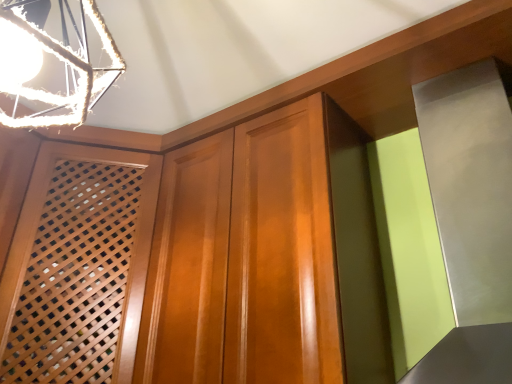
Question: Is metallic rope at upper left outside wooden lattice screen at left?

Choices:
 (A) no
 (B) yes

Answer: (B)

Question: Can you confirm if metallic rope at upper left is shorter than wooden lattice screen at left?

Choices:
 (A) yes
 (B) no

Answer: (A)

Question: From the image's perspective, does metallic rope at upper left appear lower than wooden lattice screen at left?

Choices:
 (A) no
 (B) yes

Answer: (A)

Question: Can you confirm if metallic rope at upper left is smaller than wooden lattice screen at left?

Choices:
 (A) yes
 (B) no

Answer: (A)

Question: Considering the relative sizes of metallic rope at upper left and wooden lattice screen at left in the image provided, is metallic rope at upper left taller than wooden lattice screen at left?

Choices:
 (A) yes
 (B) no

Answer: (B)

Question: From the image's perspective, does metallic rope at upper left appear higher than wooden lattice screen at left?

Choices:
 (A) yes
 (B) no

Answer: (A)

Question: From the image's perspective, is wooden lattice screen at left beneath metallic rope at upper left?

Choices:
 (A) yes
 (B) no

Answer: (A)

Question: Is wooden lattice screen at left wider than metallic rope at upper left?

Choices:
 (A) yes
 (B) no

Answer: (A)

Question: Is the position of wooden lattice screen at left more distant than that of metallic rope at upper left?

Choices:
 (A) yes
 (B) no

Answer: (A)

Question: From a real-world perspective, is wooden lattice screen at left below metallic rope at upper left?

Choices:
 (A) no
 (B) yes

Answer: (B)

Question: Is wooden lattice screen at left directly adjacent to metallic rope at upper left?

Choices:
 (A) yes
 (B) no

Answer: (B)

Question: Is wooden lattice screen at left taller than metallic rope at upper left?

Choices:
 (A) yes
 (B) no

Answer: (A)

Question: Is point (31, 200) closer or farther from the camera than point (83, 72)?

Choices:
 (A) farther
 (B) closer

Answer: (A)